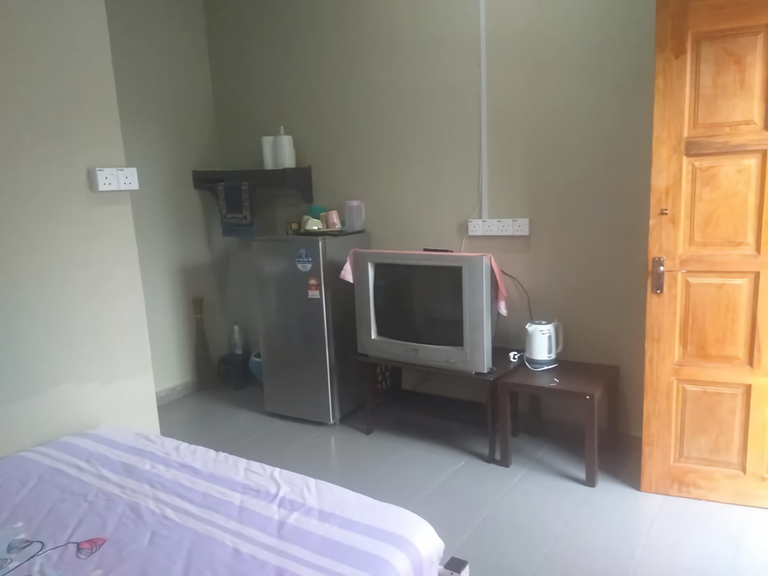
Identify the location of electric water kettle. (545, 341).